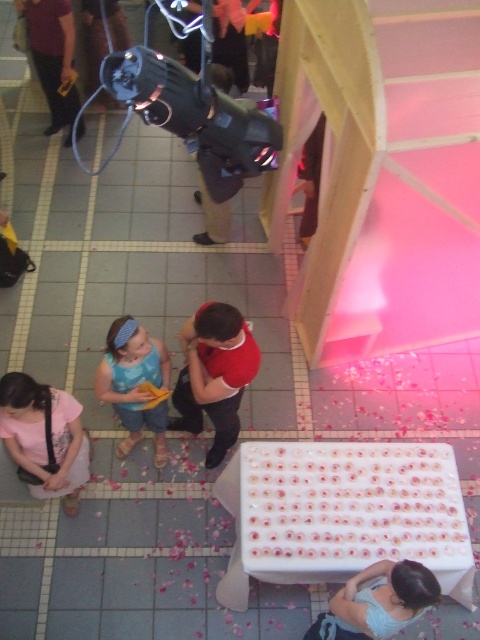
Can you confirm if matte pink shirt at lower left is wider than blue denim shorts at lower left?

Indeed, matte pink shirt at lower left has a greater width compared to blue denim shorts at lower left.

This screenshot has height=640, width=480. Describe the element at coordinates (45, 438) in the screenshot. I see `matte pink shirt at lower left` at that location.

This screenshot has width=480, height=640. In order to click on matte pink shirt at lower left in this screenshot , I will do `click(45, 438)`.